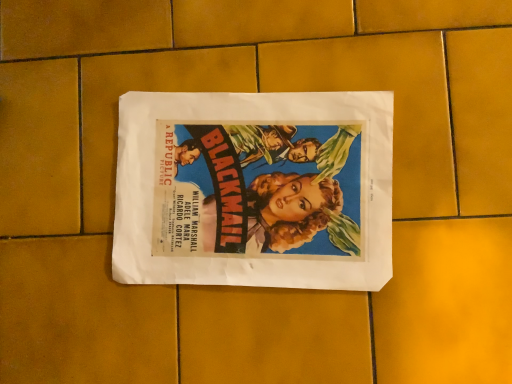
At what (x,y) coordinates should I click in order to perform the action: click on blank space above matte paper poster at center (from a real-world perspective). Please return your answer as a coordinate pair (x, y). Looking at the image, I should click on (257, 190).